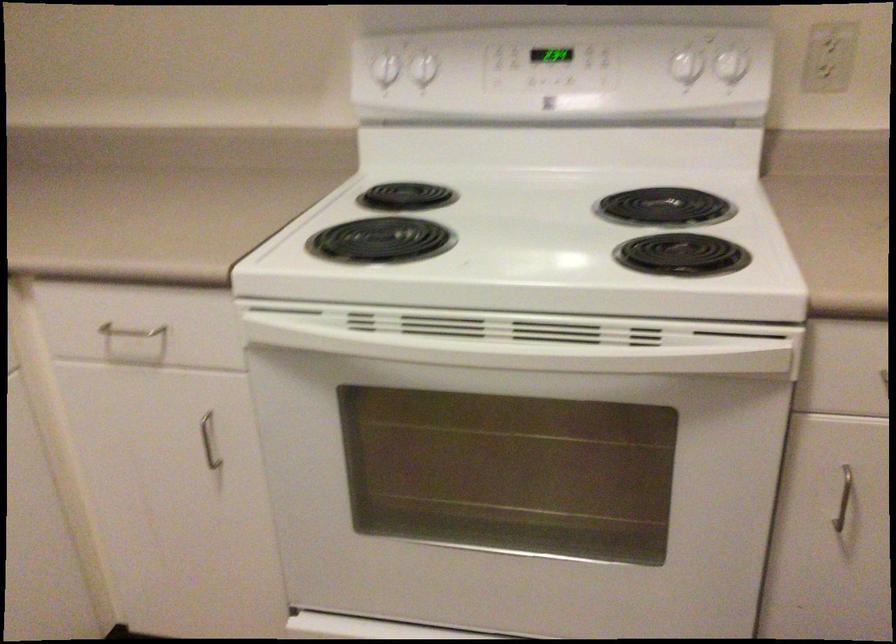
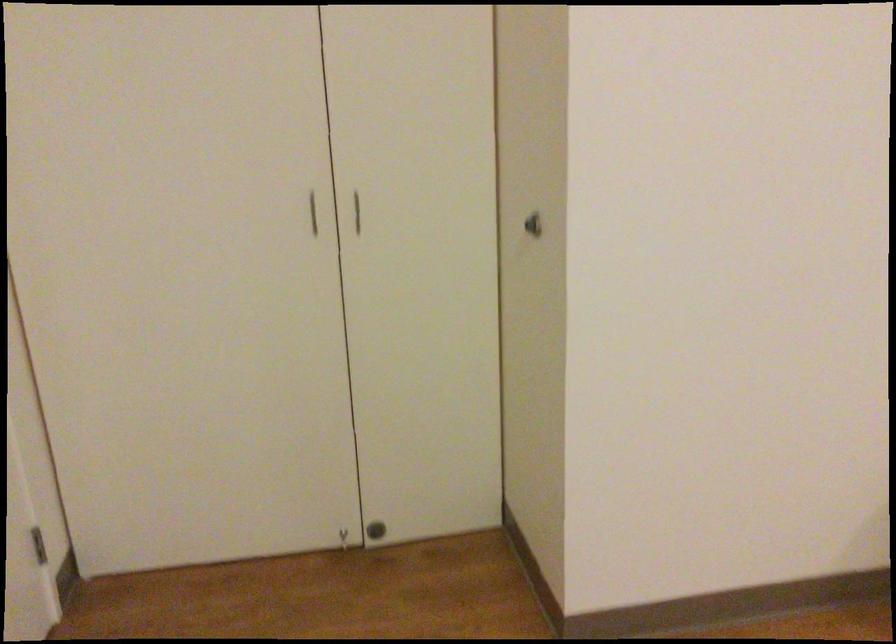
The first image is from the beginning of the video and the second image is from the end. How did the camera likely rotate when shooting the video?

The camera rotated toward right-down.